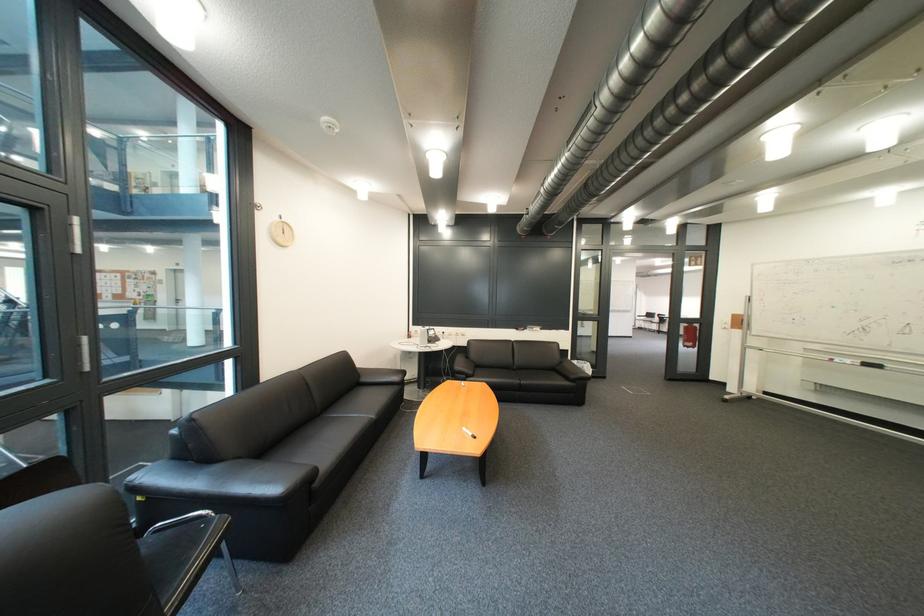
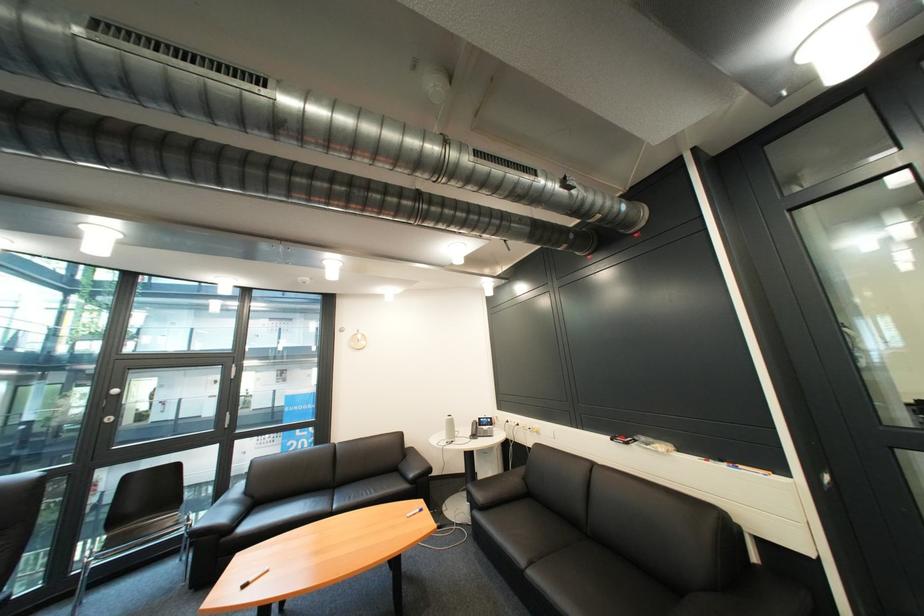
Locate, in the second image, the point that corresponds to point 441,331 in the first image.

(492, 419)